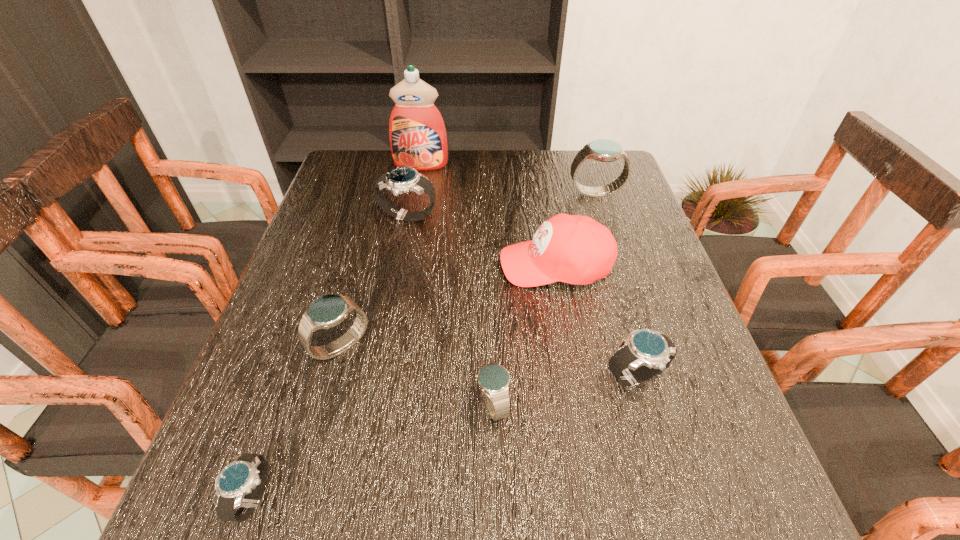
Locate an element on the screen. Image resolution: width=960 pixels, height=540 pixels. free space between the second smallest blue watch and the nearest object is located at coordinates (298, 422).

The height and width of the screenshot is (540, 960). Identify the location of vacant space that is in between the second farthest blue watch and the rightmost silver watch. (488, 362).

You are a GUI agent. You are given a task and a screenshot of the screen. Output one action in this format:
    pyautogui.click(x=<x>, y=<y>)
    Task: Click on the vacant area that lies between the biggest blue watch and the second nearest blue watch
    This screenshot has width=960, height=540.
    Given the screenshot: What is the action you would take?
    pyautogui.click(x=468, y=270)

Identify which object is located as the second nearest to the second farthest watch. Please provide its 2D coordinates. Your answer should be formatted as a tuple, i.e. [(x, y)], where the tuple contains the x and y coordinates of a point satisfying the conditions above.

[(418, 139)]

I want to click on object identified as the second closest to the second farthest blue watch, so 493,379.

Identify which watch is the fourth closest to the nearest silver watch. Please provide its 2D coordinates. Your answer should be formatted as a tuple, i.e. [(x, y)], where the tuple contains the x and y coordinates of a point satisfying the conditions above.

[(403, 179)]

At what (x,y) coordinates should I click in order to perform the action: click on the third closest watch to the second blue watch from right to left. Please return your answer as a coordinate pair (x, y). The width and height of the screenshot is (960, 540). Looking at the image, I should click on [246, 474].

Select which blue watch is the second closest to the baseball cap. Please provide its 2D coordinates. Your answer should be formatted as a tuple, i.e. [(x, y)], where the tuple contains the x and y coordinates of a point satisfying the conditions above.

[(493, 379)]

This screenshot has width=960, height=540. I want to click on blue watch object that ranks as the third closest to the nearest silver watch, so click(603, 150).

I want to click on silver watch that stands as the closest to the baseball cap, so click(403, 179).